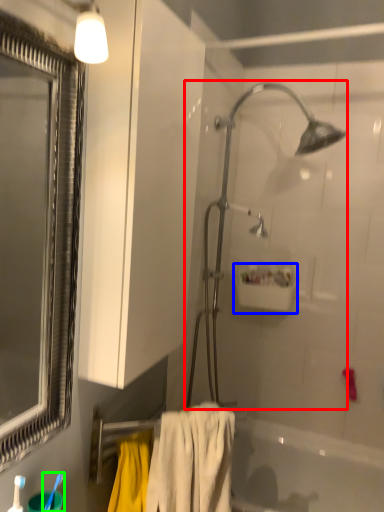
Question: Based on their relative distances, which object is nearer to shower (highlighted by a red box)? Choose from sink (highlighted by a blue box) and toothbrush (highlighted by a green box).

Choices:
 (A) sink
 (B) toothbrush

Answer: (A)